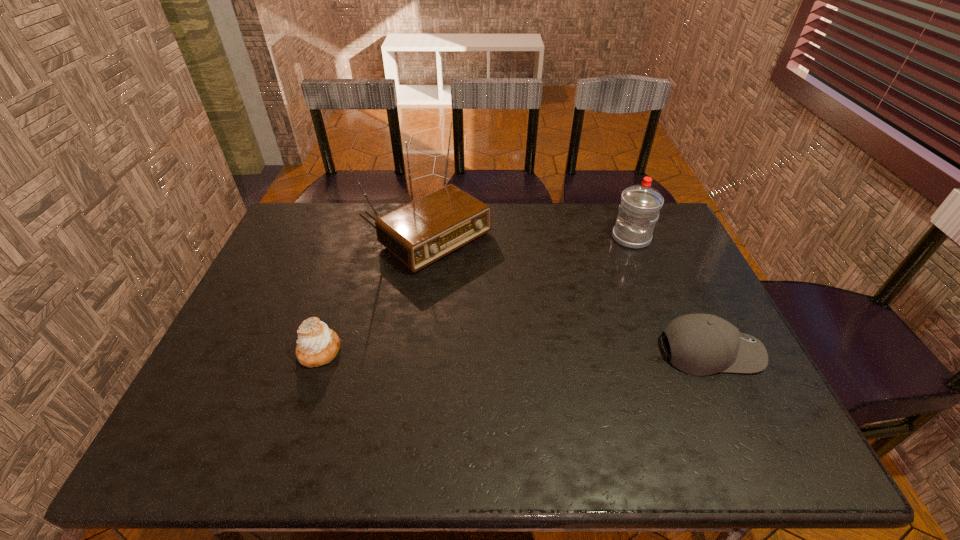
Where is `vacant position located on the front panel of the tallest object`? vacant position located on the front panel of the tallest object is located at coordinates point(504,293).

Where is `water bottle at the far edge`? water bottle at the far edge is located at coordinates (640, 205).

The width and height of the screenshot is (960, 540). In order to click on radio_receiver at the far edge in this screenshot , I will do `click(419, 233)`.

The image size is (960, 540). I want to click on baseball cap located in the right edge section of the desktop, so click(x=701, y=344).

You are a GUI agent. You are given a task and a screenshot of the screen. Output one action in this format:
    pyautogui.click(x=<x>, y=<y>)
    Task: Click on the water bottle that is at the right edge
    
    Given the screenshot: What is the action you would take?
    pyautogui.click(x=640, y=205)

This screenshot has height=540, width=960. I want to click on object that is at the far right corner, so click(640, 205).

The height and width of the screenshot is (540, 960). I want to click on free space at the far edge of the desktop, so click(x=337, y=243).

This screenshot has width=960, height=540. I want to click on free location at the near edge of the desktop, so click(669, 406).

This screenshot has height=540, width=960. I want to click on vacant space at the left edge of the desktop, so click(x=262, y=373).

The image size is (960, 540). I want to click on vacant region at the right edge of the desktop, so click(735, 376).